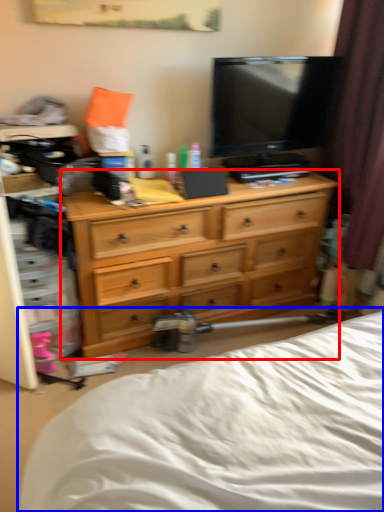
Question: Which object appears closest to the camera in this image, chest of drawers (highlighted by a red box) or bed (highlighted by a blue box)?

Choices:
 (A) chest of drawers
 (B) bed

Answer: (B)